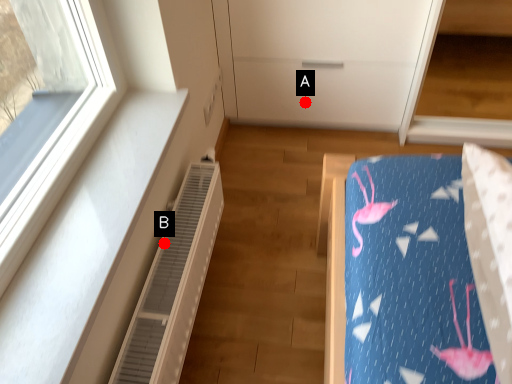
Question: Two points are circled on the image, labeled by A and B beside each circle. Which point is farther to the camera?

Choices:
 (A) A is further
 (B) B is further

Answer: (A)